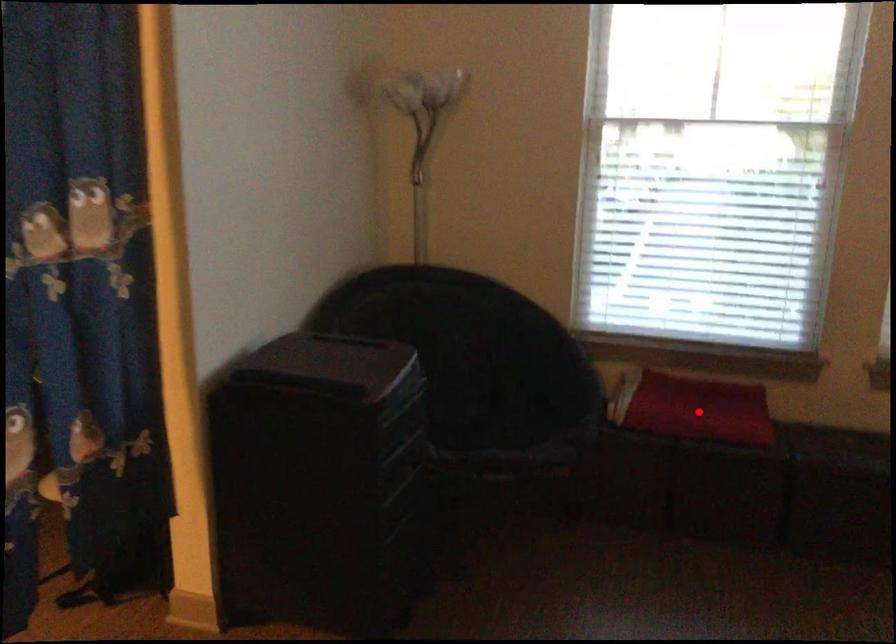
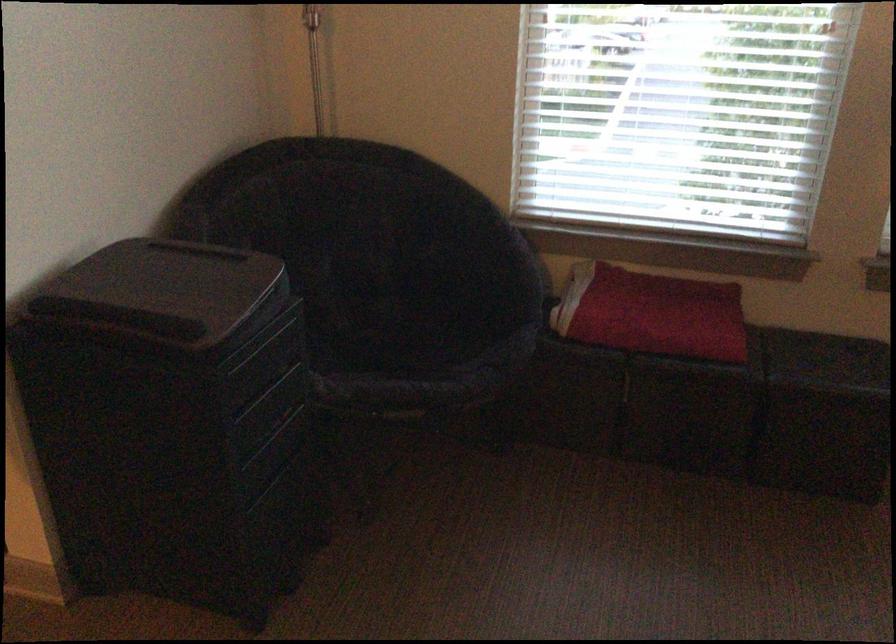
Question: I am providing you with two images of the same scene from different viewpoints. Given a red point in image1, look at the same physical point in image2. Is it:

Choices:
 (A) Closer to the viewpoint
 (B) Farther from the viewpoint

Answer: (A)